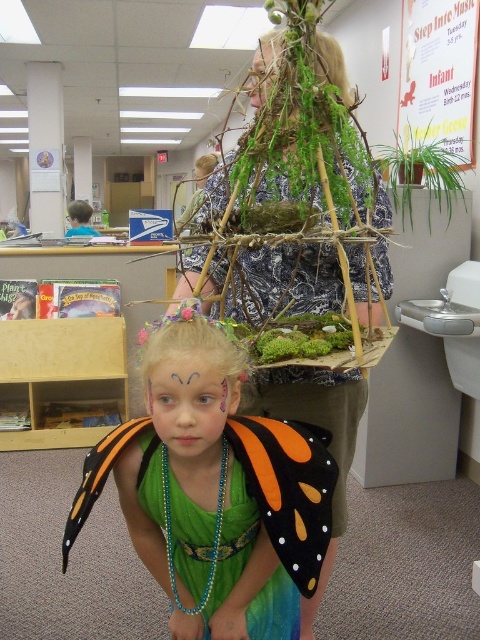
Can you confirm if pastel face paint at center is bigger than smooth skin at center?

Incorrect, pastel face paint at center is not larger than smooth skin at center.

Is pastel face paint at center above smooth skin at center?

No, pastel face paint at center is not above smooth skin at center.

The height and width of the screenshot is (640, 480). Find the location of `pastel face paint at center`. pastel face paint at center is located at coordinates (190, 403).

Between point (296, 628) and point (431, 163), which one is positioned behind?

Positioned behind is point (431, 163).

Measure the distance between green sequined dress at center and camera.

green sequined dress at center and camera are 1.04 meters apart from each other.

The width and height of the screenshot is (480, 640). Find the location of `green sequined dress at center`. green sequined dress at center is located at coordinates (232, 540).

In the scene shown: Who is higher up, green sequined dress at center or smooth skin face at center?

Positioned higher is smooth skin face at center.

Which is more to the left, green sequined dress at center or smooth skin face at center?

Positioned to the left is smooth skin face at center.

What are the coordinates of `green sequined dress at center` in the screenshot? It's located at (232, 540).

Locate an element on the screen. The image size is (480, 640). green sequined dress at center is located at coordinates (232, 540).